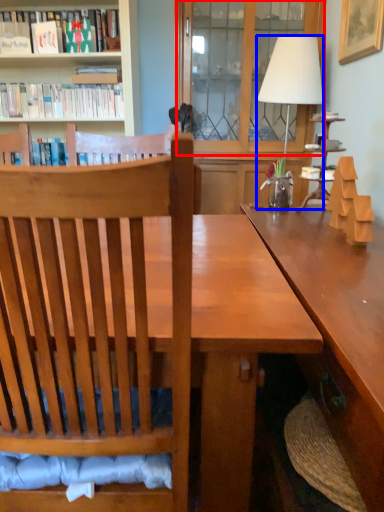
Question: Which of the following is the farthest to the observer, glass door (highlighted by a red box) or lamp (highlighted by a blue box)?

Choices:
 (A) glass door
 (B) lamp

Answer: (A)